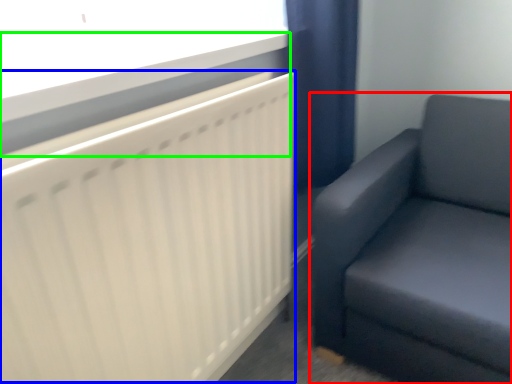
Question: Which object is the closest to the studio couch (highlighted by a red box)? Choose among these: radiator (highlighted by a blue box) or window sill (highlighted by a green box).

Choices:
 (A) radiator
 (B) window sill

Answer: (A)